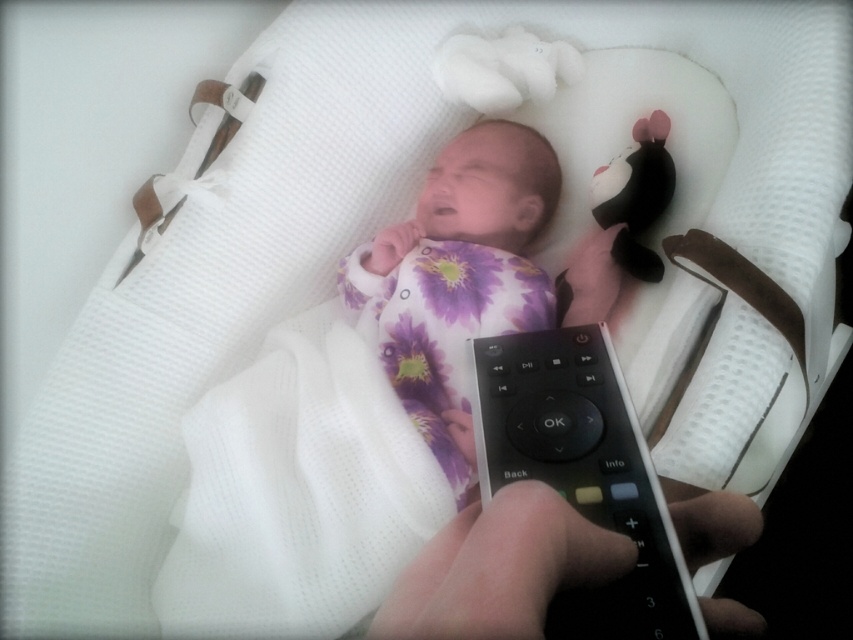
You are a parent holding the black plastic remote at center. You want to place it on the bassinet next to the purple floral fabric newborn at center. Can you do this without moving the newborn?

The purple floral fabric newborn at center is further to the viewer than the black plastic remote at center, so the remote is closer to the bassinet. Therefore, you can place the black plastic remote at center on the bassinet next to the purple floral fabric newborn at center without moving the newborn.

You are a parent holding the black matte remote control at center and want to place it next to the purple floral fabric newborn at center in the bassinet. Can you do so without moving the newborn? The bassinet is 20 inches wide.

The distance between the purple floral fabric newborn at center and the black matte remote control at center is 17.33 inches. Since the bassinet is 20 inches wide, there is enough space to place the remote control next to the newborn without moving them.